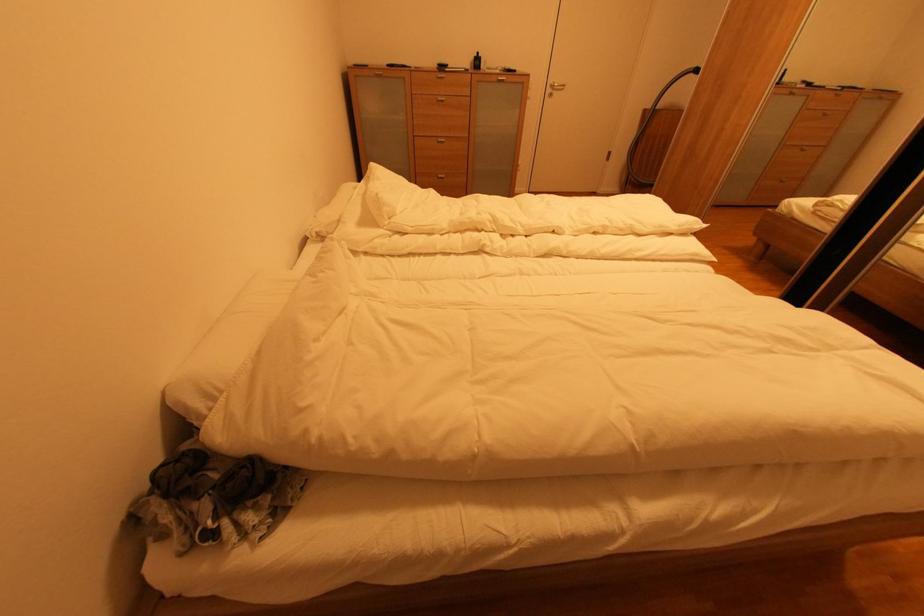
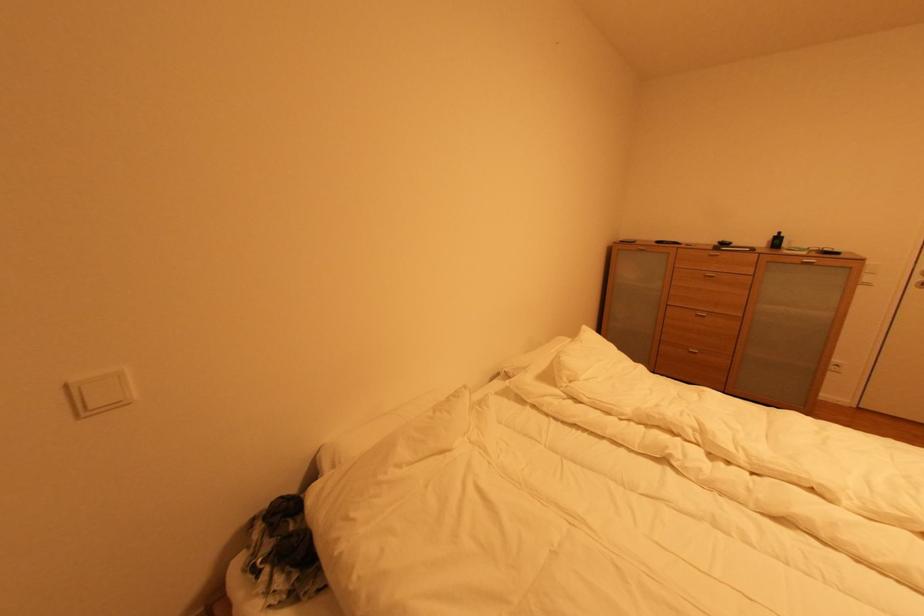
Question: Based on the continuous images, in which direction is the camera rotating? Reply with the corresponding letter.

Choices:
 (A) Left
 (B) Right
 (C) Up
 (D) Down

Answer: (A)